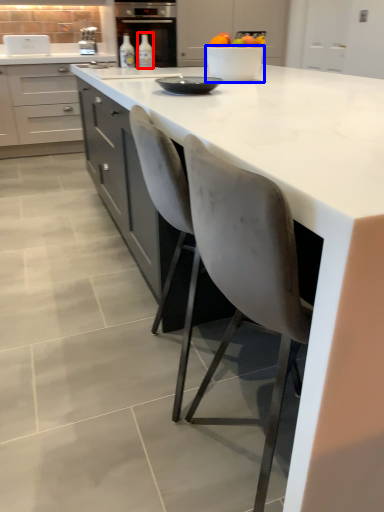
Question: Which object is further to the camera taking this photo, bottle (highlighted by a red box) or bowl (highlighted by a blue box)?

Choices:
 (A) bottle
 (B) bowl

Answer: (A)